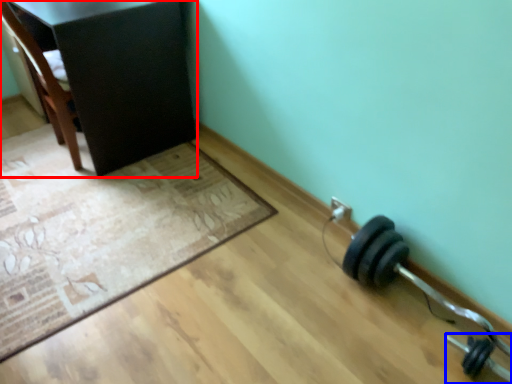
Question: Which object is further to the camera taking this photo, furniture (highlighted by a red box) or dumbbell (highlighted by a blue box)?

Choices:
 (A) furniture
 (B) dumbbell

Answer: (A)